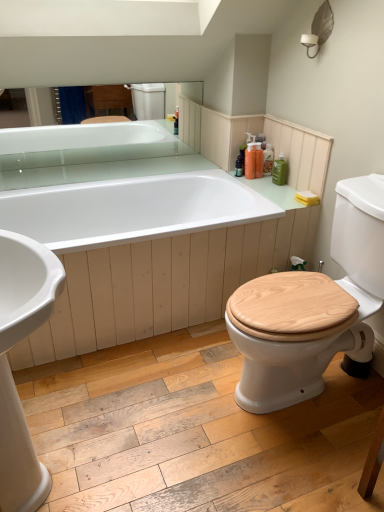
Question: Would you consider translucent plastic bottles at upper right, the second toiletry in the right-to-left sequence, to be distant from translucent orange bottle at upper right, the third toiletry from the right?

Choices:
 (A) no
 (B) yes

Answer: (A)

Question: Considering the relative sizes of translucent plastic bottles at upper right, which is counted as the second toiletry, starting from the left, and translucent orange bottle at upper right, the third toiletry from the right, in the image provided, is translucent plastic bottles at upper right, which is counted as the second toiletry, starting from the left, wider than translucent orange bottle at upper right, the third toiletry from the right,?

Choices:
 (A) yes
 (B) no

Answer: (B)

Question: Does translucent plastic bottles at upper right, the second toiletry in the right-to-left sequence, have a lesser width compared to translucent orange bottle at upper right, the third toiletry from the right?

Choices:
 (A) no
 (B) yes

Answer: (B)

Question: Is the position of translucent plastic bottles at upper right, which is counted as the second toiletry, starting from the left, more distant than that of translucent orange bottle at upper right, the third toiletry from the right?

Choices:
 (A) yes
 (B) no

Answer: (A)

Question: From a real-world perspective, is translucent plastic bottles at upper right, which is counted as the second toiletry, starting from the left, below translucent orange bottle at upper right, marked as the first toiletry in a left-to-right arrangement?

Choices:
 (A) no
 (B) yes

Answer: (A)

Question: Considering the positions of translucent orange bottle at upper right, the third toiletry from the right, and green matte bottle at upper right, the 1th toiletry viewed from the right, in the image, is translucent orange bottle at upper right, the third toiletry from the right, bigger or smaller than green matte bottle at upper right, the 1th toiletry viewed from the right,?

Choices:
 (A) big
 (B) small

Answer: (A)

Question: From the image's perspective, is translucent orange bottle at upper right, the third toiletry from the right, above or below green matte bottle at upper right, the 3th toiletry in the left-to-right sequence?

Choices:
 (A) above
 (B) below

Answer: (A)

Question: Based on their positions, is translucent orange bottle at upper right, the third toiletry from the right, located to the left or right of green matte bottle at upper right, the 1th toiletry viewed from the right?

Choices:
 (A) left
 (B) right

Answer: (A)

Question: Relative to green matte bottle at upper right, the 1th toiletry viewed from the right, is translucent orange bottle at upper right, the third toiletry from the right, in front or behind?

Choices:
 (A) behind
 (B) front

Answer: (A)

Question: Is wooden at right wider or thinner than white glossy bathtub at center?

Choices:
 (A) wide
 (B) thin

Answer: (B)

Question: Is wooden at right situated inside white glossy bathtub at center or outside?

Choices:
 (A) inside
 (B) outside

Answer: (B)

Question: From the image's perspective, is wooden at right located above or below white glossy bathtub at center?

Choices:
 (A) below
 (B) above

Answer: (A)

Question: Is point (259, 276) closer or farther from the camera than point (127, 318)?

Choices:
 (A) farther
 (B) closer

Answer: (B)

Question: In the image, is white glossy bathtub at center on the left side or the right side of translucent plastic bottles at upper right, the second toiletry in the right-to-left sequence?

Choices:
 (A) left
 (B) right

Answer: (A)

Question: Is white glossy bathtub at center wider or thinner than translucent plastic bottles at upper right, the second toiletry in the right-to-left sequence?

Choices:
 (A) wide
 (B) thin

Answer: (A)